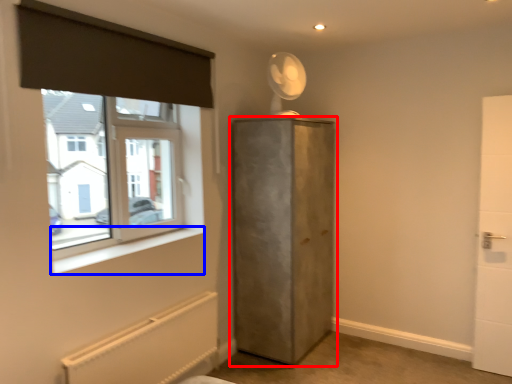
Question: Which point is closer to the camera, door (highlighted by a red box) or window sill (highlighted by a blue box)?

Choices:
 (A) door
 (B) window sill

Answer: (B)